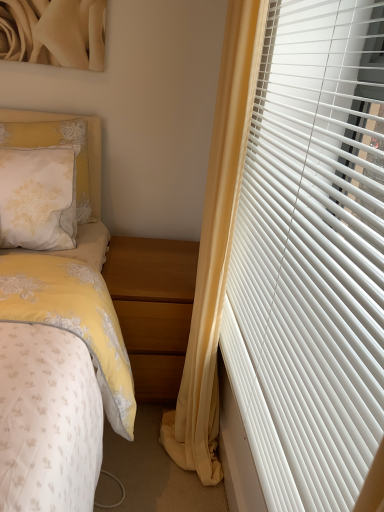
Question: Is white plastic blinds at right at the right side of light brown wood at lower center?

Choices:
 (A) yes
 (B) no

Answer: (A)

Question: Is white plastic blinds at right at the left side of light brown wood at lower center?

Choices:
 (A) yes
 (B) no

Answer: (B)

Question: Can you confirm if white plastic blinds at right is smaller than light brown wood at lower center?

Choices:
 (A) yes
 (B) no

Answer: (A)

Question: Is white plastic blinds at right outside of light brown wood at lower center?

Choices:
 (A) no
 (B) yes

Answer: (B)

Question: Is white plastic blinds at right next to light brown wood at lower center and touching it?

Choices:
 (A) yes
 (B) no

Answer: (B)

Question: Considering the relative positions of white plastic blinds at right and light brown wood at lower center in the image provided, is white plastic blinds at right behind light brown wood at lower center?

Choices:
 (A) yes
 (B) no

Answer: (B)

Question: Would you say white plastic blinds at right contains yellow fabric curtain at right?

Choices:
 (A) yes
 (B) no

Answer: (B)

Question: From the image's perspective, is white plastic blinds at right over yellow fabric curtain at right?

Choices:
 (A) yes
 (B) no

Answer: (A)

Question: Does white plastic blinds at right have a greater height compared to yellow fabric curtain at right?

Choices:
 (A) yes
 (B) no

Answer: (B)

Question: Can you confirm if white plastic blinds at right is wider than yellow fabric curtain at right?

Choices:
 (A) yes
 (B) no

Answer: (B)

Question: Does white plastic blinds at right have a larger size compared to yellow fabric curtain at right?

Choices:
 (A) no
 (B) yes

Answer: (A)

Question: Is white plastic blinds at right closer to camera compared to yellow fabric curtain at right?

Choices:
 (A) yes
 (B) no

Answer: (A)

Question: Considering the relative sizes of light brown wood at lower center and white lace pillow at upper left in the image provided, is light brown wood at lower center thinner than white lace pillow at upper left?

Choices:
 (A) yes
 (B) no

Answer: (B)